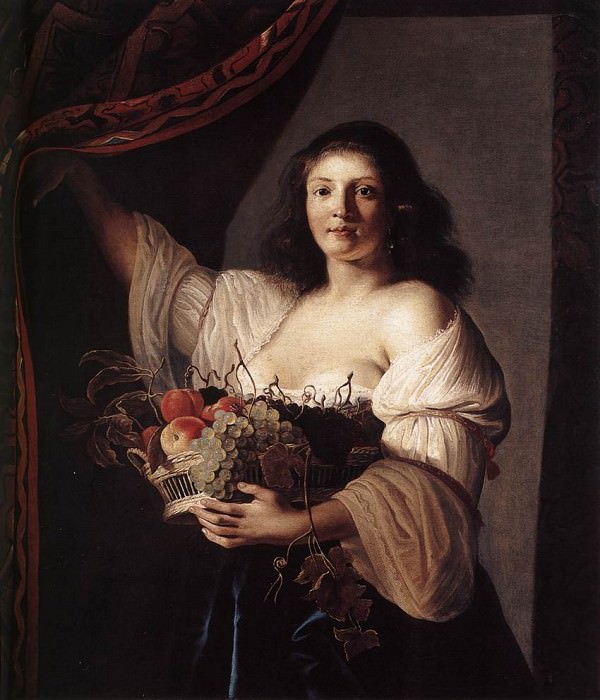
At what (x,y) coordinates should I click in order to perform the action: click on curtain. Please return your answer as a coordinate pair (x, y). This screenshot has height=700, width=600. Looking at the image, I should click on (196, 112).